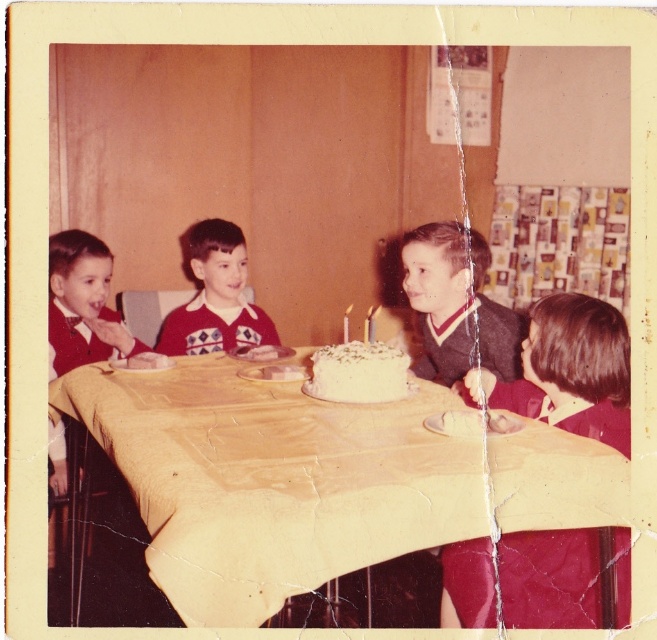
Which is more to the left, yellow paper tablecloth at center or white frosted cake at center?

From the viewer's perspective, yellow paper tablecloth at center appears more on the left side.

Who is positioned more to the right, yellow paper tablecloth at center or white frosted cake at center?

From the viewer's perspective, white frosted cake at center appears more on the right side.

Who is more forward, (622, 524) or (392, 387)?

Positioned in front is point (622, 524).

In order to click on yellow paper tablecloth at center in this screenshot , I will do `click(273, 481)`.

Who is shorter, yellow paper tablecloth at center or matte red sweater at center?

yellow paper tablecloth at center

The image size is (657, 640). What do you see at coordinates (273, 481) in the screenshot?
I see `yellow paper tablecloth at center` at bounding box center [273, 481].

Is point (514, 435) behind point (183, 237)?

No, it is in front of (183, 237).

In order to click on yellow paper tablecloth at center in this screenshot , I will do `click(273, 481)`.

Between yellow paper tablecloth at center and dark brown hair at right, which one has less height?

Standing shorter between the two is yellow paper tablecloth at center.

Which is behind, point (474, 461) or point (451, 620)?

The point (451, 620) is behind.

Is point (313, 477) behind point (604, 380)?

No.

You are a GUI agent. You are given a task and a screenshot of the screen. Output one action in this format:
    pyautogui.click(x=<x>, y=<y>)
    Task: Click on the yellow paper tablecloth at center
    
    Given the screenshot: What is the action you would take?
    pyautogui.click(x=273, y=481)